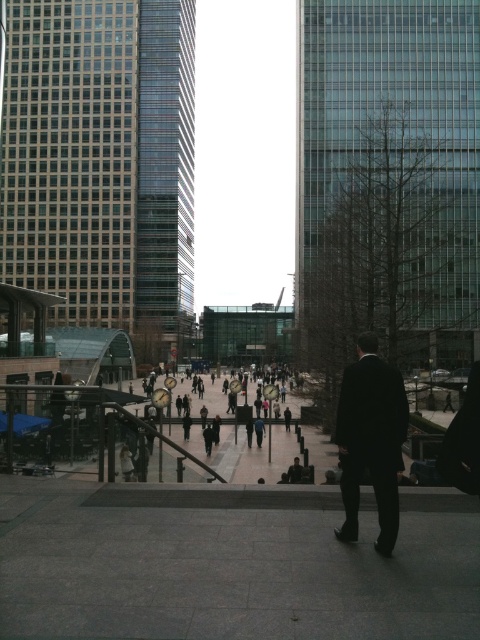
Between gray concrete pavement at center and black suit at center, which one is positioned lower?

gray concrete pavement at center is lower down.

Which is more to the right, gray concrete pavement at center or black suit at center?

black suit at center is more to the right.

Image resolution: width=480 pixels, height=640 pixels. I want to click on gray concrete pavement at center, so click(x=228, y=570).

Image resolution: width=480 pixels, height=640 pixels. I want to click on gray concrete pavement at center, so click(x=228, y=570).